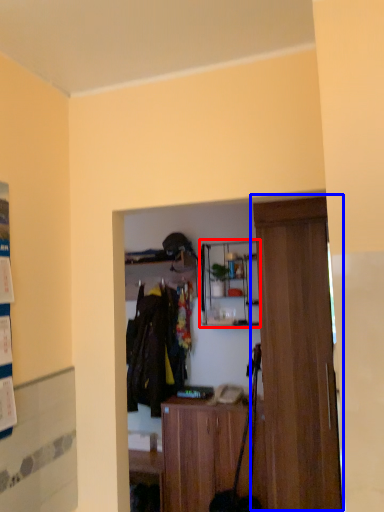
Question: Which object is further to the camera taking this photo, shelf (highlighted by a red box) or door (highlighted by a blue box)?

Choices:
 (A) shelf
 (B) door

Answer: (A)